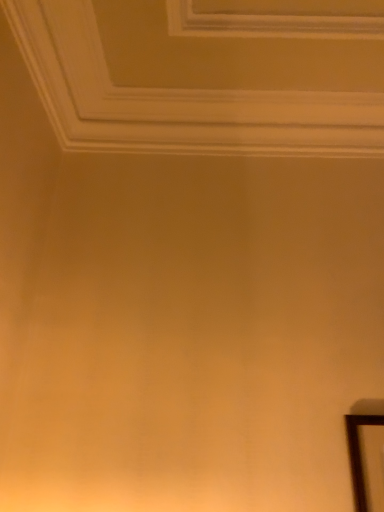
What is the approximate width of brown wooden picture frame at lower right?

3.86 centimeters.

Image resolution: width=384 pixels, height=512 pixels. What do you see at coordinates (361, 458) in the screenshot?
I see `brown wooden picture frame at lower right` at bounding box center [361, 458].

You are a GUI agent. You are given a task and a screenshot of the screen. Output one action in this format:
    pyautogui.click(x=<x>, y=<y>)
    Task: Click on the brown wooden picture frame at lower right
    
    Given the screenshot: What is the action you would take?
    pyautogui.click(x=361, y=458)

The width and height of the screenshot is (384, 512). What are the coordinates of `brown wooden picture frame at lower right` in the screenshot? It's located at (361, 458).